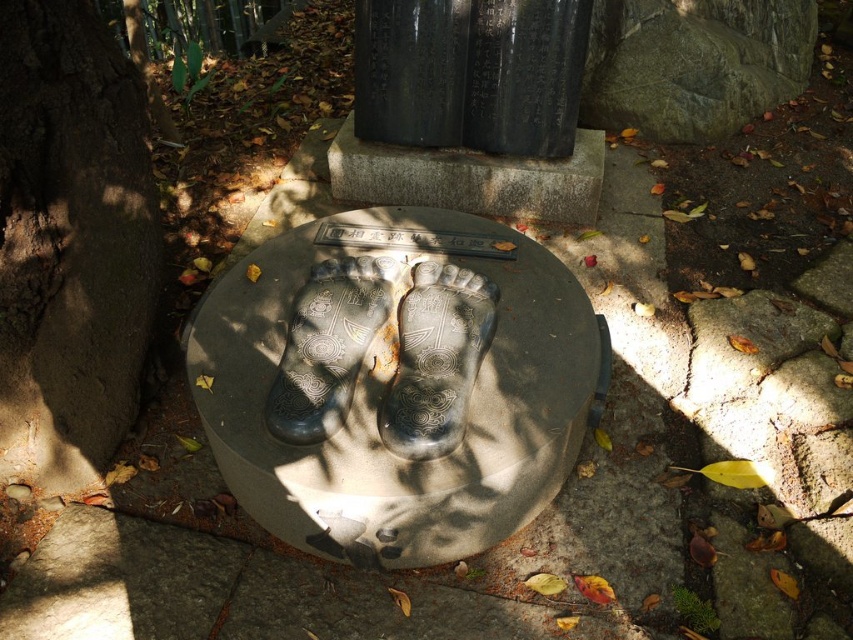
Is point (403, 356) positioned after point (339, 323)?

No, (403, 356) is in front of (339, 323).

Who is positioned more to the left, gray stone foot at center or black stone foot at center?

black stone foot at center

Who is more distant from viewer, (418, 346) or (331, 368)?

The point (418, 346) is behind.

This screenshot has height=640, width=853. What are the coordinates of `gray stone foot at center` in the screenshot? It's located at (436, 358).